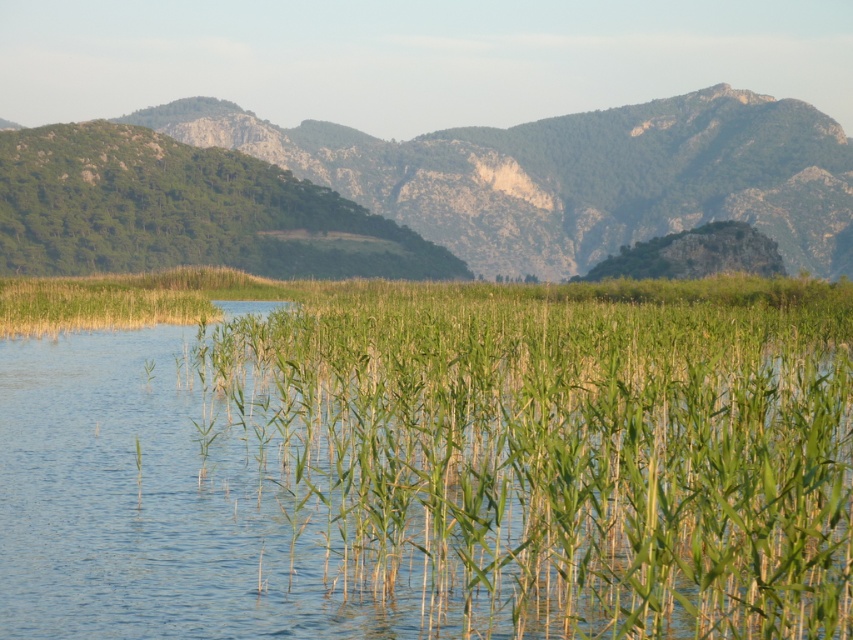
Consider the image. Who is higher up, green leafy grass at center or green textured grass at upper center?

green textured grass at upper center

Between point (682, 387) and point (692, 209), which one is positioned in front?

Point (682, 387) is in front.

Find the location of a particular element. The height and width of the screenshot is (640, 853). green leafy grass at center is located at coordinates (555, 445).